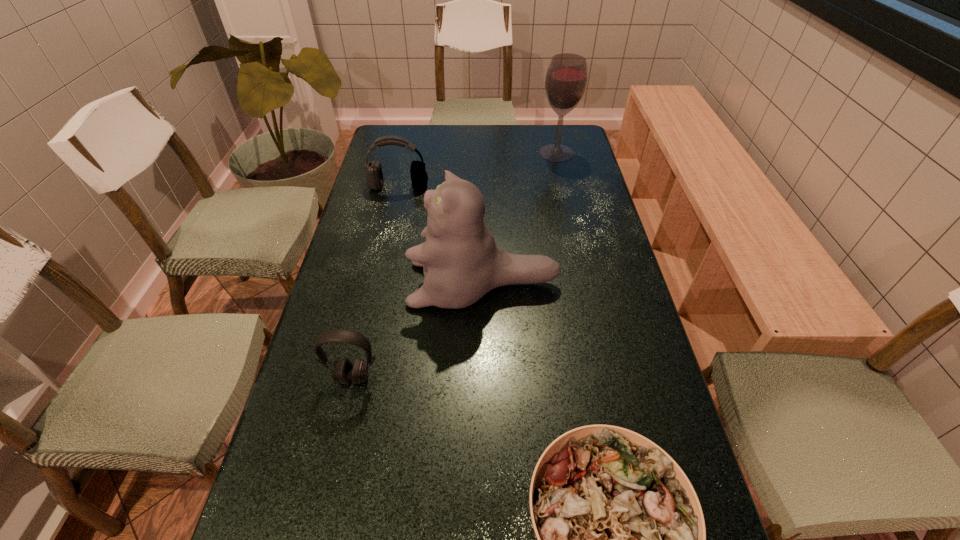
In order to click on object positioned at the far edge in this screenshot , I will do `click(566, 78)`.

The height and width of the screenshot is (540, 960). Find the location of `object positioned at the right edge`. object positioned at the right edge is located at coordinates (566, 78).

Find the location of a particular element. The height and width of the screenshot is (540, 960). object that is at the far right corner is located at coordinates (566, 78).

In order to click on vacant region at the left edge of the desktop in this screenshot , I will do `click(402, 198)`.

In the image, there is a desktop. Where is `vacant space at the right edge`? vacant space at the right edge is located at coordinates (601, 261).

Locate an element on the screen. Image resolution: width=960 pixels, height=540 pixels. free spot at the far left corner of the desktop is located at coordinates (408, 149).

You are a GUI agent. You are given a task and a screenshot of the screen. Output one action in this format:
    pyautogui.click(x=<x>, y=<y>)
    Task: Click on the free space that is in between the fourth farthest object and the fourth nearest object
    
    Given the screenshot: What is the action you would take?
    pyautogui.click(x=376, y=282)

Locate an element on the screen. free spot between the second farthest object and the alcohol is located at coordinates (477, 170).

The image size is (960, 540). In order to click on free spot between the fourth farthest object and the second farthest object in this screenshot , I will do `click(376, 282)`.

This screenshot has width=960, height=540. In order to click on free space between the farthest object and the farther headset in this screenshot , I will do `click(477, 170)`.